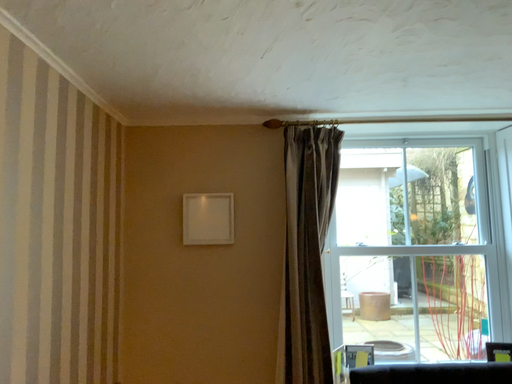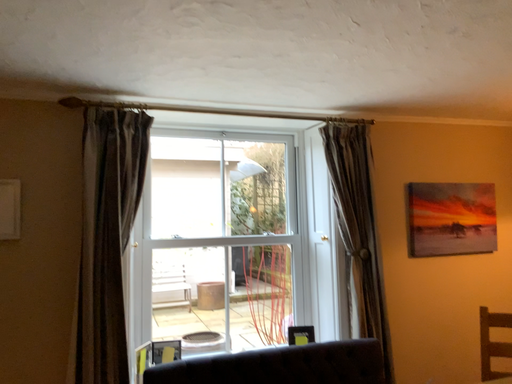
Question: Which way did the camera rotate in the video?

Choices:
 (A) rotated left
 (B) rotated right

Answer: (B)